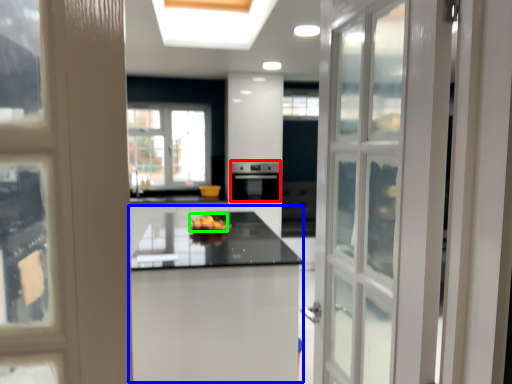
Question: Which is nearer to the appliance (highlighted by a red box)? table (highlighted by a blue box) or fruit (highlighted by a green box).

Choices:
 (A) table
 (B) fruit

Answer: (B)